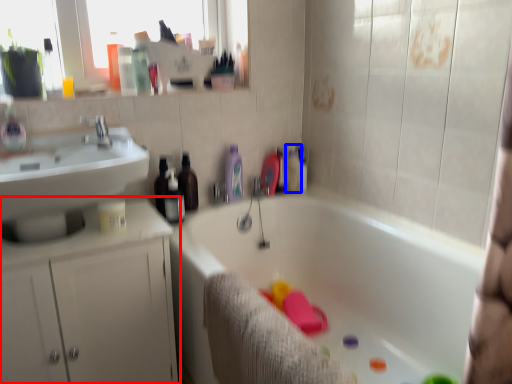
Question: Which of the following is the closest to the observer, bathroom cabinet (highlighted by a red box) or toiletry (highlighted by a blue box)?

Choices:
 (A) bathroom cabinet
 (B) toiletry

Answer: (A)